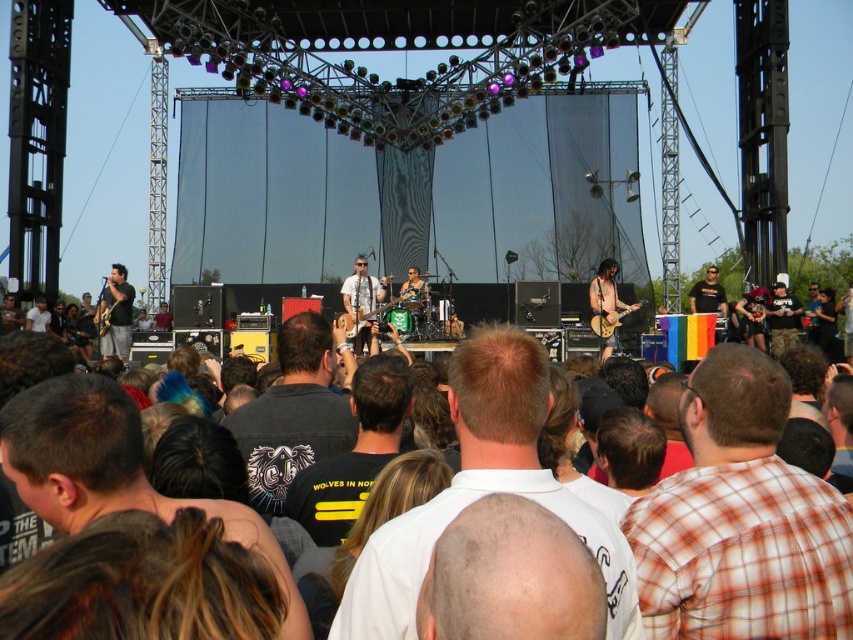
Question: Which of these objects is positioned farthest from the matte black guitar at center?

Choices:
 (A) bald head at center
 (B) black cotton t-shirt at center
 (C) white shirt at center

Answer: (A)

Question: Is white shirt at center to the right of matte black shirt at left from the viewer's perspective?

Choices:
 (A) yes
 (B) no

Answer: (A)

Question: Can you confirm if plaid shirt at center is smaller than bald head at center?

Choices:
 (A) no
 (B) yes

Answer: (A)

Question: Which point appears closest to the camera in this image?

Choices:
 (A) (593, 328)
 (B) (514, 333)
 (C) (106, 308)

Answer: (B)

Question: Which object appears closest to the camera in this image?

Choices:
 (A) matte black shirt at left
 (B) plaid shirt at center
 (C) black t-shirt at center
 (D) bald head at center

Answer: (D)

Question: Does matte black shirt at left have a greater width compared to camouflage pants at center?

Choices:
 (A) no
 (B) yes

Answer: (B)